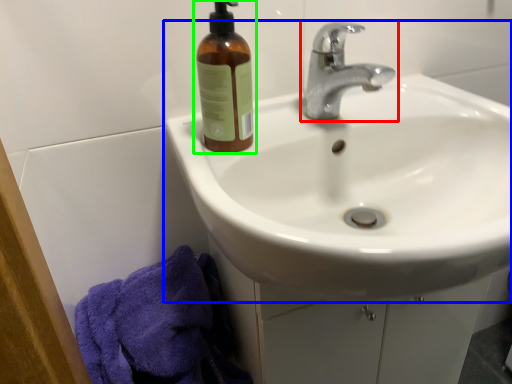
Question: Estimate the real-world distances between objects in this image. Which object is closer to tap (highlighted by a red box), sink (highlighted by a blue box) or bottle (highlighted by a green box)?

Choices:
 (A) sink
 (B) bottle

Answer: (A)